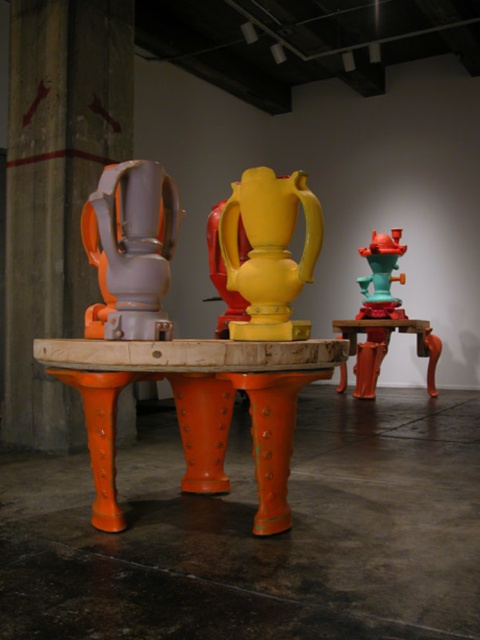
Is matte gray vase at center below yellow matte vase at center?

No, matte gray vase at center is not below yellow matte vase at center.

Can you confirm if matte gray vase at center is bigger than yellow matte vase at center?

Indeed, matte gray vase at center has a larger size compared to yellow matte vase at center.

Measure the distance between matte gray vase at center and camera.

matte gray vase at center is 1.97 meters away from camera.

Find the location of `matte gray vase at center`. matte gray vase at center is located at coordinates (131, 250).

Can you confirm if orange metallic table at center is thinner than teal glossy fire hydrant at center right?

Incorrect, orange metallic table at center's width is not less than teal glossy fire hydrant at center right's.

Identify the location of orange metallic table at center. (196, 406).

Does orange matte/finish pedestal at left appear on the left side of matte gray vase at center?

Correct, you'll find orange matte/finish pedestal at left to the left of matte gray vase at center.

In the scene shown: Does orange matte/finish pedestal at left have a greater height compared to matte gray vase at center?

Yes.

Does point (76, 1) come in front of point (159, 308)?

That is False.

In order to click on orange matte/finish pedestal at left in this screenshot , I will do `click(57, 192)`.